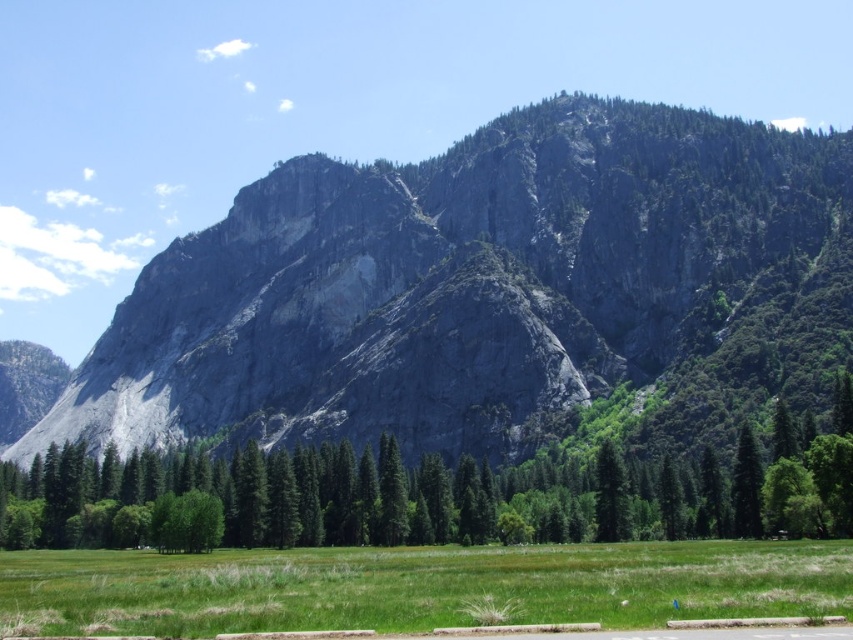
Question: Is green matte tree at center smaller than green matte tree at center-right?

Choices:
 (A) no
 (B) yes

Answer: (A)

Question: Which point is farther to the camera?

Choices:
 (A) gray rock mountain at center
 (B) green matte tree at center-right

Answer: (A)

Question: Can you confirm if green matte tree at center is thinner than green matte tree at center-right?

Choices:
 (A) yes
 (B) no

Answer: (A)

Question: Which point appears farthest from the camera in this image?

Choices:
 (A) (740, 442)
 (B) (306, 472)
 (C) (614, 362)
 (D) (614, 540)

Answer: (C)

Question: Does green leafy tree at center lie in front of green matte tree at center-right?

Choices:
 (A) no
 (B) yes

Answer: (B)

Question: Which point is closer to the camera?

Choices:
 (A) green leafy tree at center
 (B) gray rock mountain at center

Answer: (A)